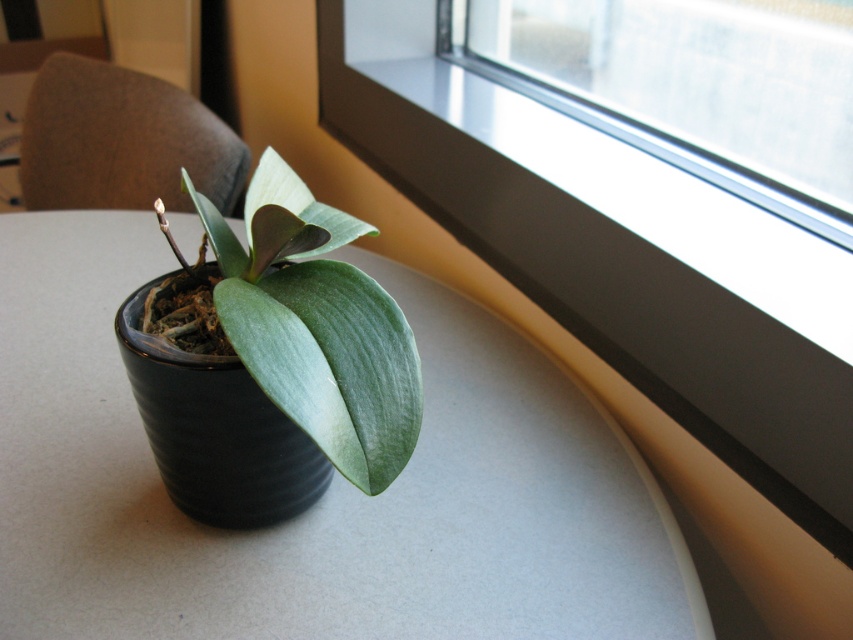
Does matte black pot at center have a lesser height compared to green matte leaf at center?

No.

Which is behind, point (529, 392) or point (276, 298)?

The point (529, 392) is more distant.

The image size is (853, 640). I want to click on matte black pot at center, so click(325, 490).

Which is in front, point (583, 0) or point (263, 467)?

Point (263, 467)

Is point (711, 164) in front of point (196, 413)?

No, (711, 164) is further to viewer.

Who is more distant from viewer, [714,77] or [251,445]?

Point [714,77]

Where is `transparent glass at upper right`? transparent glass at upper right is located at coordinates (689, 86).

Which is below, transparent glass at upper right or green matte leaf at center?

green matte leaf at center

Image resolution: width=853 pixels, height=640 pixels. What are the coordinates of `transparent glass at upper right` in the screenshot? It's located at (689, 86).

Describe the element at coordinates (689, 86) in the screenshot. The image size is (853, 640). I see `transparent glass at upper right` at that location.

The image size is (853, 640). I want to click on transparent glass at upper right, so click(689, 86).